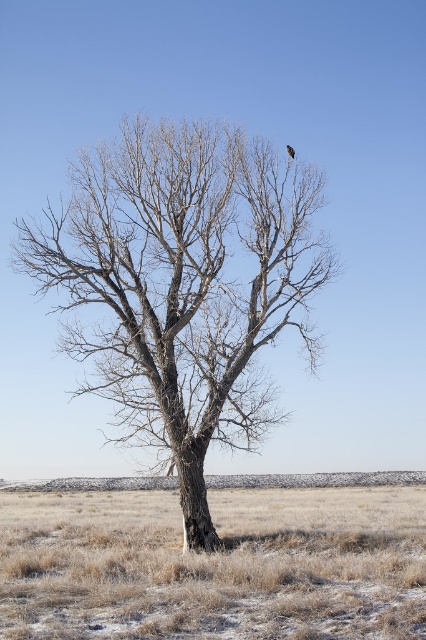
Question: Is dry grass at lower center wider than brown feathered bird at center?

Choices:
 (A) yes
 (B) no

Answer: (A)

Question: Can you confirm if brown bark tree at center is positioned above brown feathered bird at center?

Choices:
 (A) no
 (B) yes

Answer: (A)

Question: Which point is farther to the camera?

Choices:
 (A) brown feathered bird at center
 (B) dry grass at lower center

Answer: (A)

Question: Considering the real-world distances, which object is closest to the brown feathered bird at center?

Choices:
 (A) dry grass at lower center
 (B) brown bark tree at center

Answer: (B)

Question: Which is nearer to the brown feathered bird at center?

Choices:
 (A) dry grass at lower center
 (B) brown bark tree at center

Answer: (B)

Question: Can you confirm if brown bark tree at center is smaller than dry grass at lower center?

Choices:
 (A) yes
 (B) no

Answer: (A)